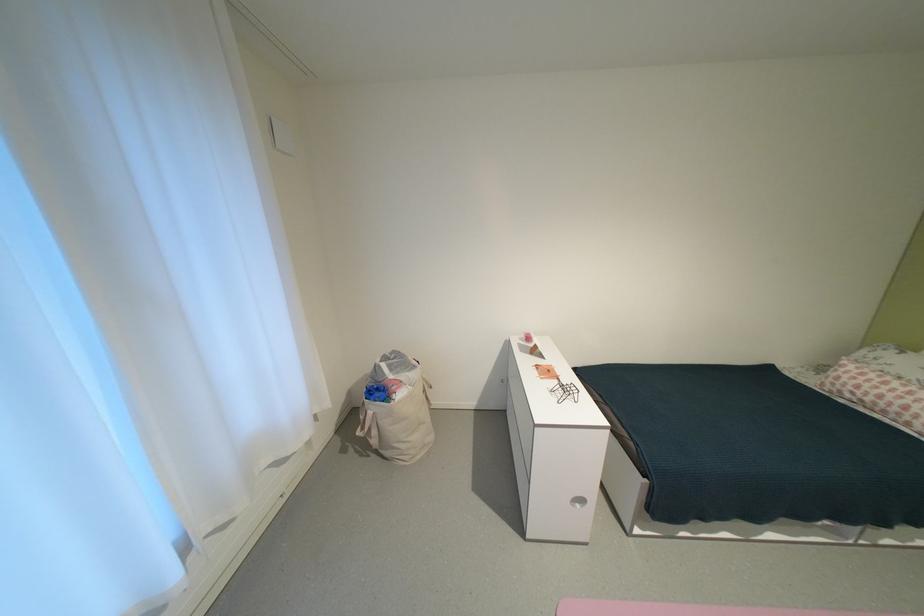
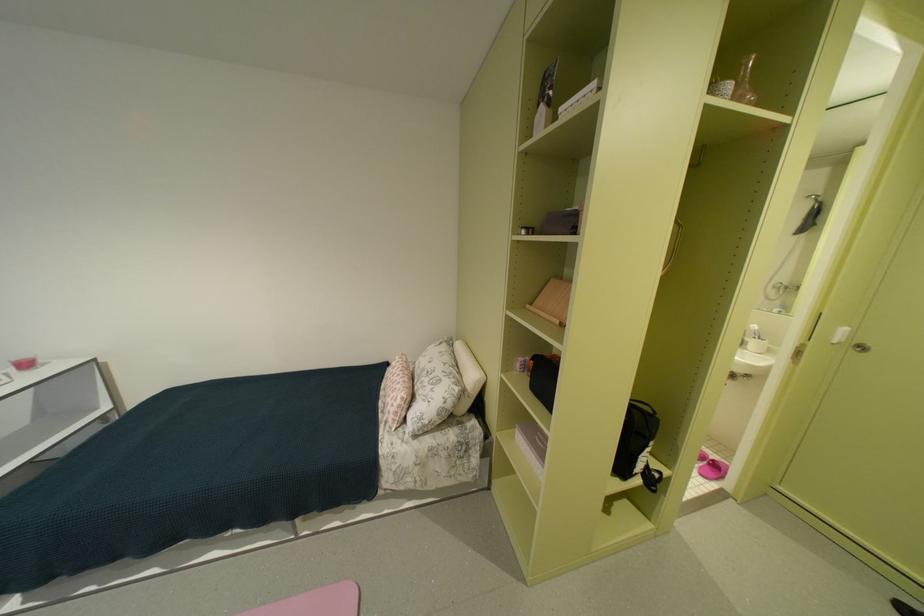
Question: What movement of the cameraman would produce the second image?

Choices:
 (A) Left
 (B) Right
 (C) Forward
 (D) Backward

Answer: (B)